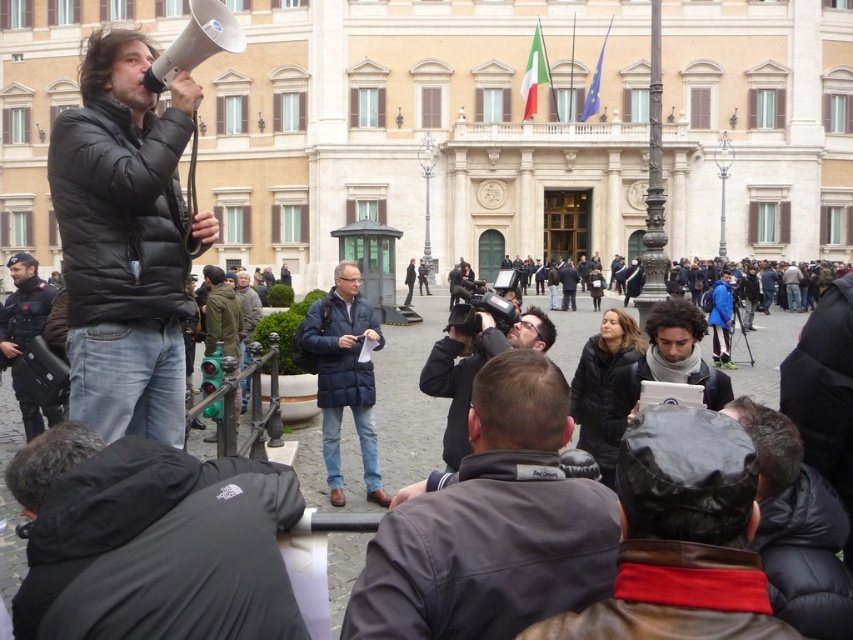
Question: Does dark gray jacket at center have a larger size compared to black matte jacket at lower right?

Choices:
 (A) no
 (B) yes

Answer: (B)

Question: Among these points, which one is nearest to the camera?

Choices:
 (A) tap(231, 310)
 (B) tap(740, 564)
 (C) tap(177, 323)
 (D) tap(27, 333)

Answer: (B)

Question: Is matte black jacket at center wider than green matte traffic light at center?

Choices:
 (A) no
 (B) yes

Answer: (A)

Question: Is black matte jacket at lower right thinner than matte black camera at center?

Choices:
 (A) no
 (B) yes

Answer: (B)

Question: Which object appears closest to the camera in this image?

Choices:
 (A) matte black camera at center
 (B) black matte jacket at lower right
 (C) matte black jacket at center
 (D) leather jacket at center

Answer: (D)

Question: Among these points, which one is farthest from the camera?

Choices:
 (A) (380, 584)
 (B) (659, 584)
 (C) (703, 376)

Answer: (C)